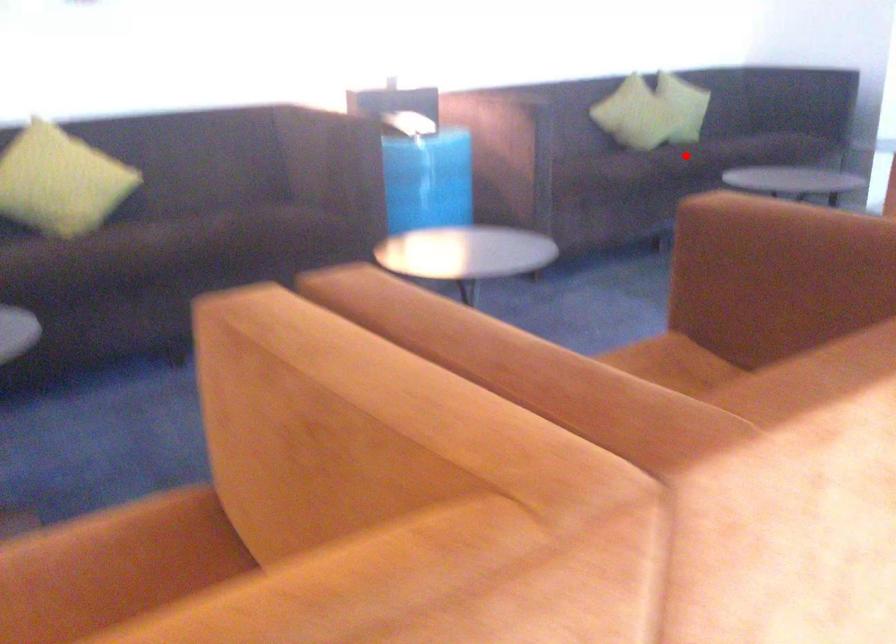
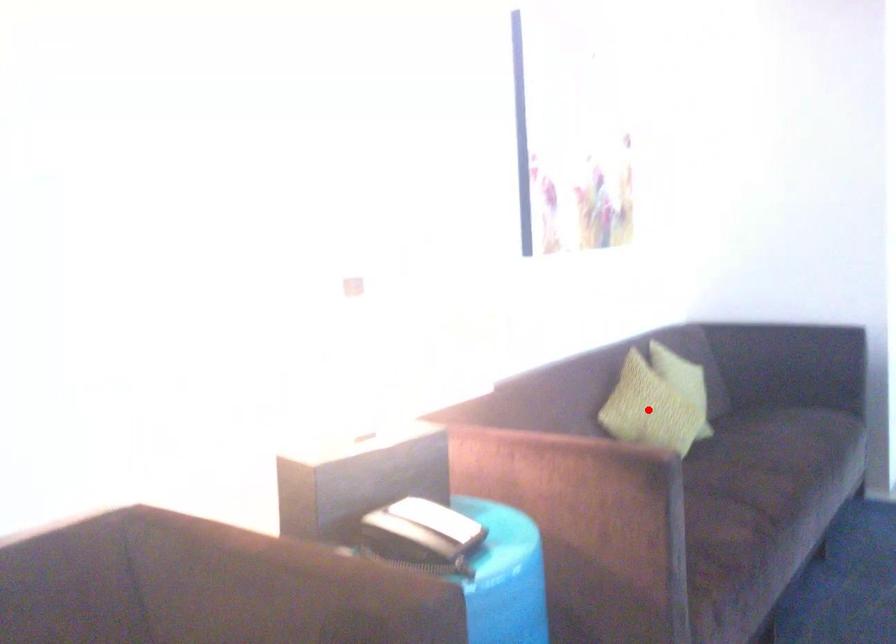
I am providing you with two images of the same scene from different viewpoints. A red point is marked on the first image and another point is marked on the second image. Do the highlighted points in image1 and image2 indicate the same real-world spot?

No